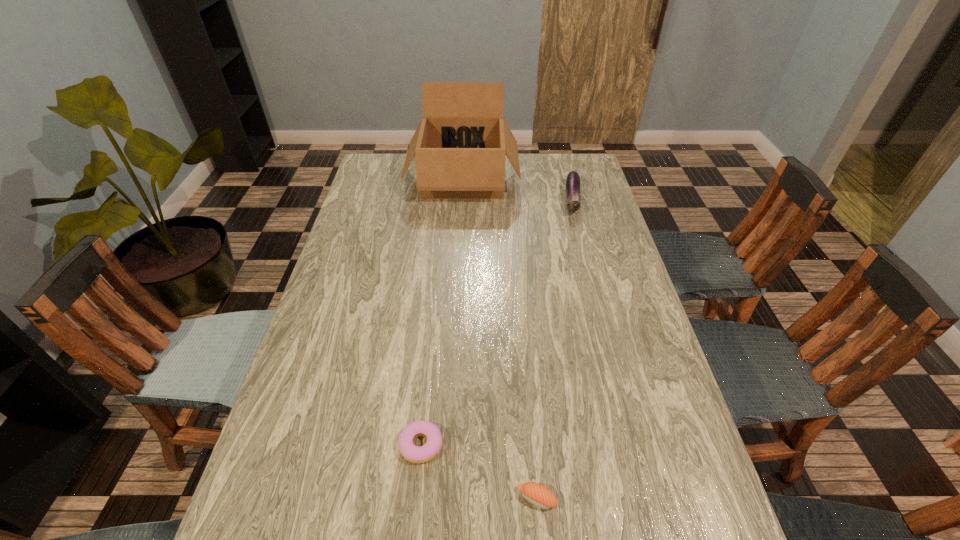
This screenshot has width=960, height=540. I want to click on object that stands as the second closest to the third tallest object, so click(572, 186).

Where is `vacant space that satisfies the following two spatial constraints: 1. on the front side of the doughnut; 2. on the left side of the nearest object`? vacant space that satisfies the following two spatial constraints: 1. on the front side of the doughnut; 2. on the left side of the nearest object is located at coordinates (416, 499).

I want to click on free region that satisfies the following two spatial constraints: 1. on the front side of the rightmost object; 2. on the left side of the tallest object, so click(462, 200).